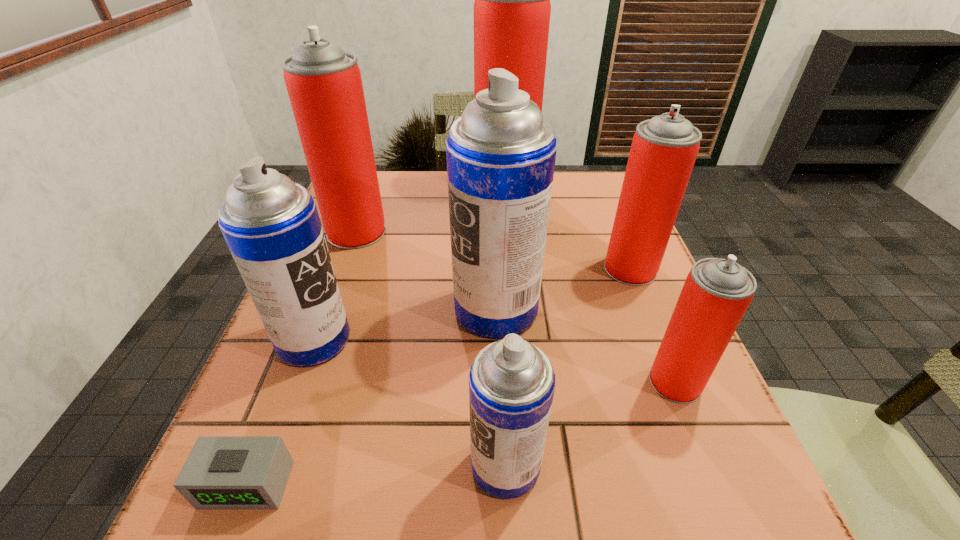
Where is `object that ranks as the sixth closest to the leftmost red aerosol can`? This screenshot has width=960, height=540. object that ranks as the sixth closest to the leftmost red aerosol can is located at coordinates (511, 382).

Choose which object is the third nearest neighbor to the biggest blue aerosol can. Please provide its 2D coordinates. Your answer should be formatted as a tuple, i.e. [(x, y)], where the tuple contains the x and y coordinates of a point satisfying the conditions above.

[(511, 382)]

Where is `aerosol can that is the third closest to the third nearest red aerosol can`? The width and height of the screenshot is (960, 540). aerosol can that is the third closest to the third nearest red aerosol can is located at coordinates (512, 8).

The image size is (960, 540). I want to click on aerosol can that is the third closest to the nearest aerosol can, so click(x=271, y=225).

The image size is (960, 540). I want to click on red aerosol can that is the second closest to the leftmost blue aerosol can, so [x=512, y=8].

You are a GUI agent. You are given a task and a screenshot of the screen. Output one action in this format:
    pyautogui.click(x=<x>, y=<y>)
    Task: Click on the red aerosol can object that ranks as the third closest to the smallest red aerosol can
    
    Given the screenshot: What is the action you would take?
    pyautogui.click(x=324, y=84)

Select which blue aerosol can appears as the second closest to the nearest aerosol can. Please provide its 2D coordinates. Your answer should be formatted as a tuple, i.e. [(x, y)], where the tuple contains the x and y coordinates of a point satisfying the conditions above.

[(271, 225)]

The width and height of the screenshot is (960, 540). I want to click on blue aerosol can that is the closest to the smallest blue aerosol can, so click(x=501, y=153).

You are a GUI agent. You are given a task and a screenshot of the screen. Output one action in this format:
    pyautogui.click(x=<x>, y=<y>)
    Task: Click on the vacant point that satisfies the following two spatial constraints: 1. on the front side of the second smallest red aerosol can; 2. on the label side of the nearest aerosol can
    The width and height of the screenshot is (960, 540).
    Given the screenshot: What is the action you would take?
    pyautogui.click(x=708, y=465)